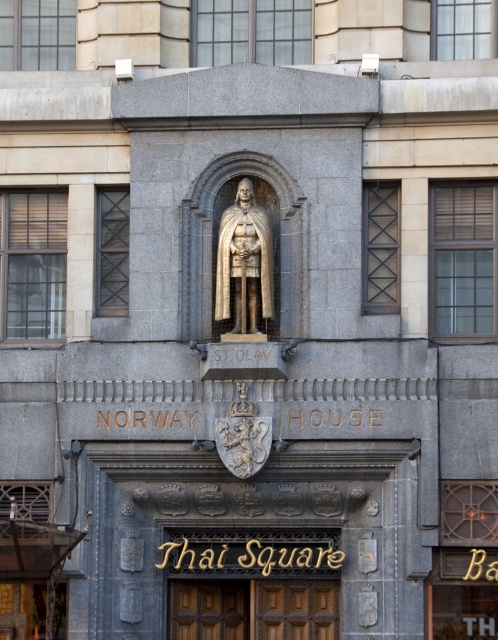
Question: Does gold wood sign at center appear under gold polished statue at center?

Choices:
 (A) yes
 (B) no

Answer: (A)

Question: Which point is farther from the camera taking this photo?

Choices:
 (A) (262, 573)
 (B) (235, 278)

Answer: (A)

Question: Which object appears farthest from the camera in this image?

Choices:
 (A) gold wood sign at center
 (B) gold polished statue at center

Answer: (A)

Question: Is gold wood sign at center below gold polished statue at center?

Choices:
 (A) no
 (B) yes

Answer: (B)

Question: Can you confirm if gold wood sign at center is positioned to the left of gold polished statue at center?

Choices:
 (A) no
 (B) yes

Answer: (A)